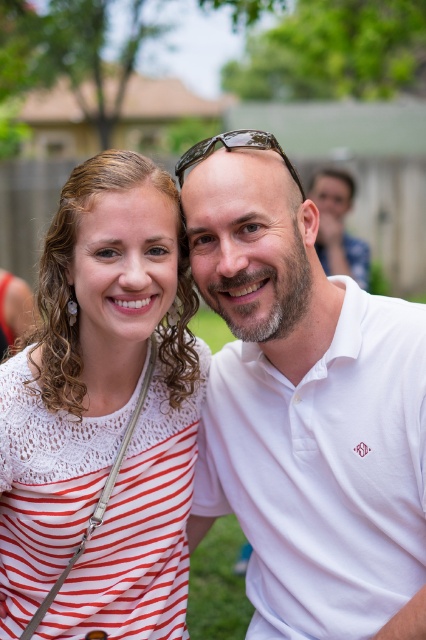
Which is below, white knitted top at center or clear plastic sunglasses at center?

Positioned lower is white knitted top at center.

Between point (66, 426) and point (181, 157), which one is positioned behind?

Positioned behind is point (181, 157).

Is point (58, 627) farther from viewer compared to point (247, 131)?

Yes, it is.

I want to click on white knitted top at center, so click(103, 413).

How far apart are white cotton polo shirt at center and white knitted top at center?

white cotton polo shirt at center is 11.94 inches from white knitted top at center.

Between point (290, 246) and point (11, 413), which one is positioned in front?

Point (11, 413) is more forward.

At what (x,y) coordinates should I click in order to perform the action: click on white cotton polo shirt at center. Please return your answer as a coordinate pair (x, y). Image resolution: width=426 pixels, height=640 pixels. Looking at the image, I should click on (299, 406).

Image resolution: width=426 pixels, height=640 pixels. What do you see at coordinates (299, 406) in the screenshot?
I see `white cotton polo shirt at center` at bounding box center [299, 406].

Does white cotton polo shirt at center have a larger size compared to clear plastic sunglasses at center?

Yes.

The height and width of the screenshot is (640, 426). Identify the location of white cotton polo shirt at center. (299, 406).